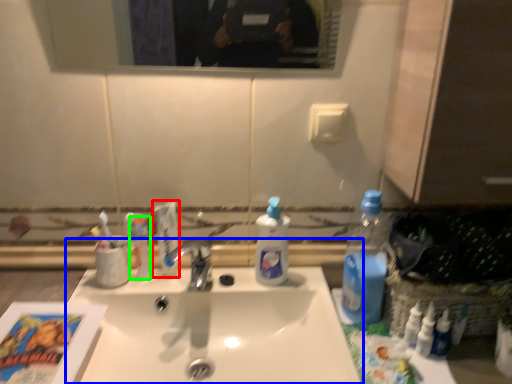
Question: Based on their relative distances, which object is farther from toothpaste (highlighted by a red box)? Choose from sink (highlighted by a blue box) and toiletry (highlighted by a green box).

Choices:
 (A) sink
 (B) toiletry

Answer: (A)